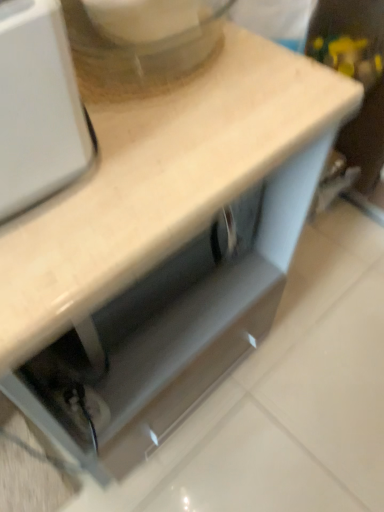
The width and height of the screenshot is (384, 512). In order to click on vacant area that is situated to the right of white matte countertop at upper center in this screenshot , I will do `click(314, 358)`.